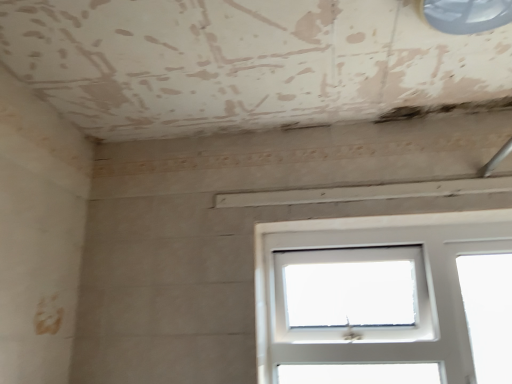
Question: Can you confirm if transparent plastic window at upper right, acting as the 2th window starting from the bottom, is taller than white plastic window at center, acting as the second window starting from the top?

Choices:
 (A) no
 (B) yes

Answer: (A)

Question: Is transparent plastic window at upper right, the second window viewed from the back, facing away from white plastic window at center, which appears as the 2th window when viewed from the front?

Choices:
 (A) no
 (B) yes

Answer: (A)

Question: From a real-world perspective, is transparent plastic window at upper right, acting as the 2th window starting from the bottom, over white plastic window at center, acting as the second window starting from the top?

Choices:
 (A) no
 (B) yes

Answer: (B)

Question: Is transparent plastic window at upper right, the second window viewed from the back, not within white plastic window at center, acting as the second window starting from the top?

Choices:
 (A) yes
 (B) no

Answer: (A)

Question: Can you confirm if transparent plastic window at upper right, the first window from the top, is wider than white plastic window at center, which appears as the 2th window when viewed from the front?

Choices:
 (A) yes
 (B) no

Answer: (A)

Question: Does transparent plastic window at upper right, placed as the first window when sorted from front to back, lie in front of white plastic window at center, positioned as the 1th window in back-to-front order?

Choices:
 (A) yes
 (B) no

Answer: (A)

Question: Can you confirm if white plastic window at center, the 1th window ordered from the bottom, is taller than transparent plastic window at upper right, placed as the first window when sorted from front to back?

Choices:
 (A) no
 (B) yes

Answer: (B)

Question: Does white plastic window at center, positioned as the 1th window in back-to-front order, lie behind transparent plastic window at upper right, placed as the first window when sorted from front to back?

Choices:
 (A) yes
 (B) no

Answer: (A)

Question: Is white plastic window at center, which appears as the 2th window when viewed from the front, wider than transparent plastic window at upper right, placed as the first window when sorted from front to back?

Choices:
 (A) no
 (B) yes

Answer: (A)

Question: From a real-world perspective, is white plastic window at center, acting as the second window starting from the top, positioned under transparent plastic window at upper right, placed as the first window when sorted from front to back, based on gravity?

Choices:
 (A) yes
 (B) no

Answer: (A)

Question: Is transparent plastic window at upper right, the second window viewed from the back, a part of white plastic window at center, which appears as the 2th window when viewed from the front?

Choices:
 (A) yes
 (B) no

Answer: (B)

Question: Considering the relative sizes of white plastic window at center, acting as the second window starting from the top, and transparent plastic window at upper right, acting as the 2th window starting from the bottom, in the image provided, is white plastic window at center, acting as the second window starting from the top, shorter than transparent plastic window at upper right, acting as the 2th window starting from the bottom,?

Choices:
 (A) yes
 (B) no

Answer: (B)

Question: Is transparent plastic window at upper right, the second window viewed from the back, inside or outside of white plastic window at center, acting as the second window starting from the top?

Choices:
 (A) outside
 (B) inside

Answer: (A)